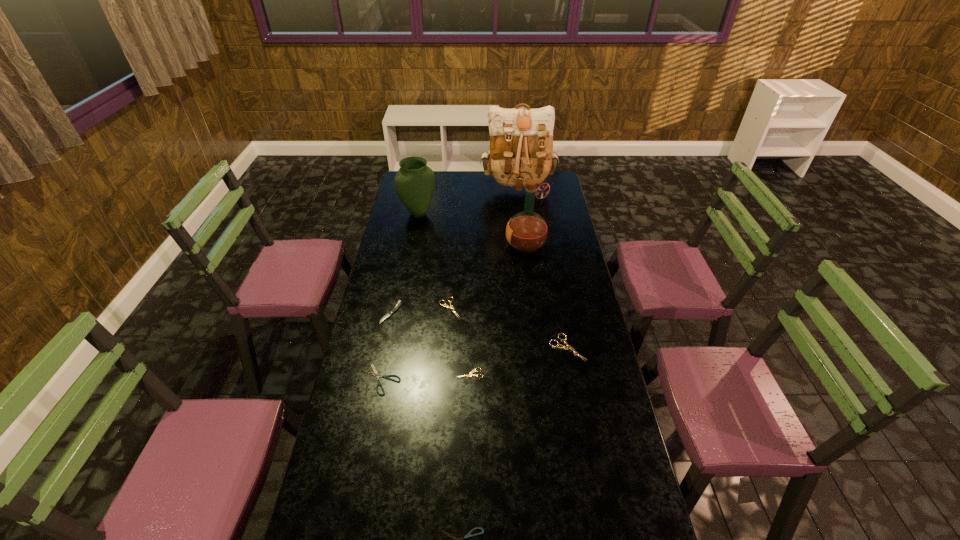
The height and width of the screenshot is (540, 960). Find the location of `backpack`. backpack is located at coordinates (521, 139).

Find the location of a particular element. brown backpack is located at coordinates (521, 139).

The width and height of the screenshot is (960, 540). What are the coordinates of `pink liquor` in the screenshot? It's located at (526, 232).

Locate an element on the screen. The image size is (960, 540). liquor is located at coordinates (526, 232).

Find the location of `green vase`. green vase is located at coordinates (414, 182).

Where is `vase`? The image size is (960, 540). vase is located at coordinates (414, 182).

Find the location of `pocketknife`. pocketknife is located at coordinates (398, 305).

Identify the location of the sixth farthest object. This screenshot has width=960, height=540. (563, 347).

At what (x,y) coordinates should I click in order to perform the action: click on the second farthest beige shears. Please return your answer as a coordinate pair (x, y). Looking at the image, I should click on (563, 347).

The image size is (960, 540). What are the coordinates of `the farthest beige shears` in the screenshot? It's located at (447, 306).